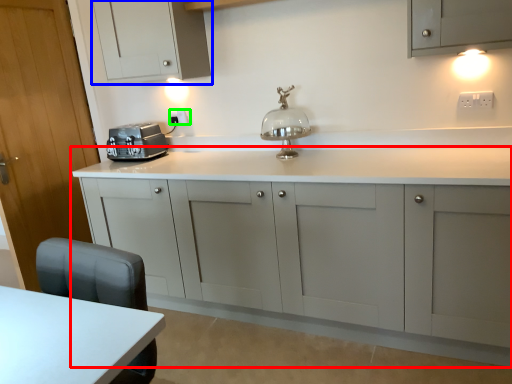
Question: Which object is the farthest from cabinetry (highlighted by a red box)? Choose among these: cabinetry (highlighted by a blue box) or electric outlet (highlighted by a green box).

Choices:
 (A) cabinetry
 (B) electric outlet

Answer: (B)